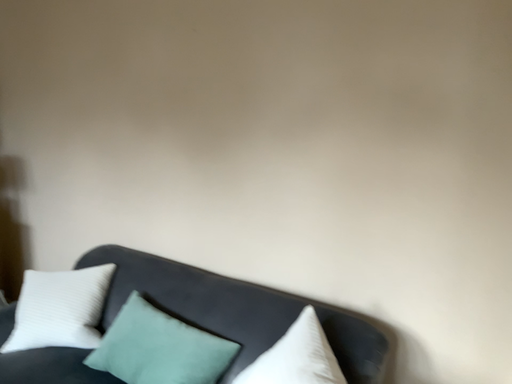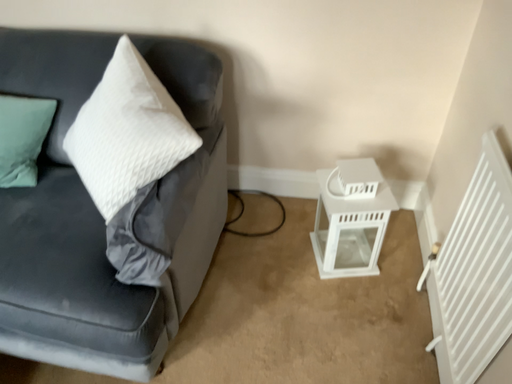
Question: How did the camera likely rotate when shooting the video?

Choices:
 (A) rotated right
 (B) rotated left

Answer: (A)